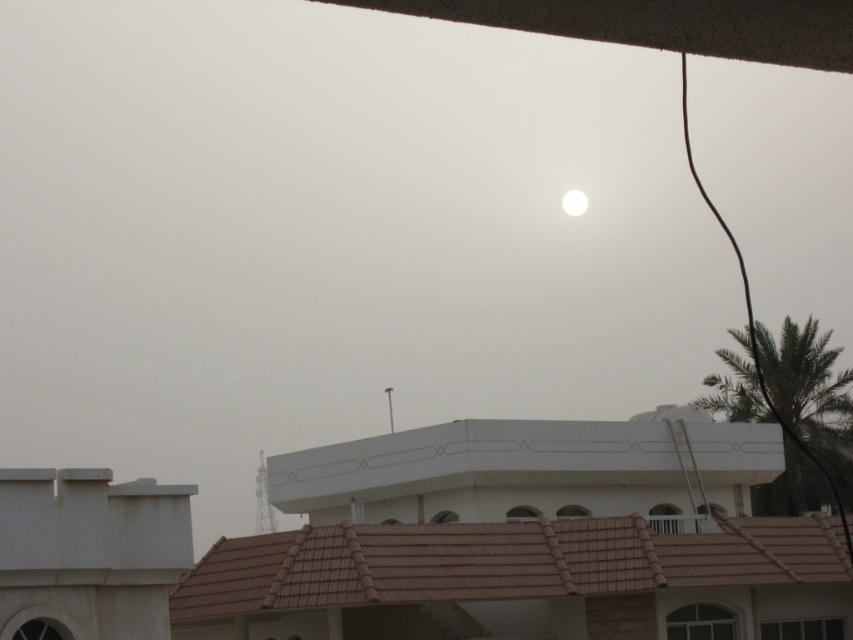
Question: Among these points, which one is farthest from the camera?

Choices:
 (A) (775, 385)
 (B) (575, 200)

Answer: (B)

Question: Considering the relative positions of green leafy palm tree at upper right and white glossy moon at upper center in the image provided, where is green leafy palm tree at upper right located with respect to white glossy moon at upper center?

Choices:
 (A) left
 (B) right

Answer: (B)

Question: Can you confirm if green leafy palm tree at upper right is bigger than white glossy moon at upper center?

Choices:
 (A) no
 (B) yes

Answer: (B)

Question: From the image, what is the correct spatial relationship of green leafy palm tree at upper right in relation to white glossy moon at upper center?

Choices:
 (A) right
 (B) left

Answer: (A)

Question: Which point is farther to the camera?

Choices:
 (A) (820, 426)
 (B) (566, 198)

Answer: (B)